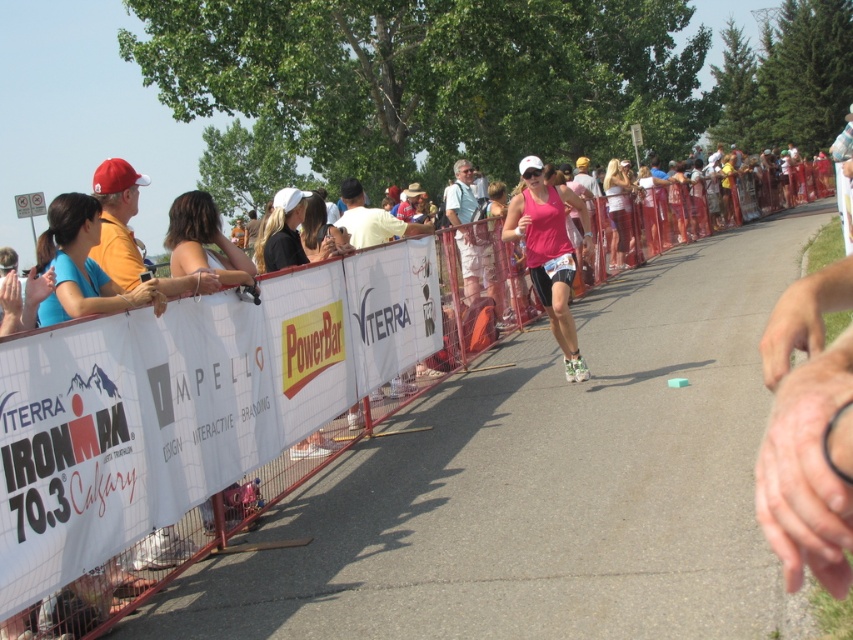
You are a photographer positioned at the side of the road during the IRONMAN 70.3 Calgary race. You want to capture a photo of the pink matte tank top at center without including the white plastic barrier at center in the frame. Based on their positions, is this possible?

The white plastic barrier at center is to the right of the pink matte tank top at center, so if you position yourself to the right of the pink matte tank top at center and aim the camera away from the barrier, you can exclude the barrier from the frame.

You are a race official at the IRONMAN 70.3 Calgary event. You need to place two cones at the coordinates provided in the image. The first cone must be placed at point (x=277, y=486) and the second at point (x=566, y=257). Which cone will be closer to the female athlete who is running towards the camera?

The cone placed at point (x=277, y=486) will be closer to the female athlete because it is in front of point (x=566, y=257), meaning it is nearer to her path as she runs towards the camera.